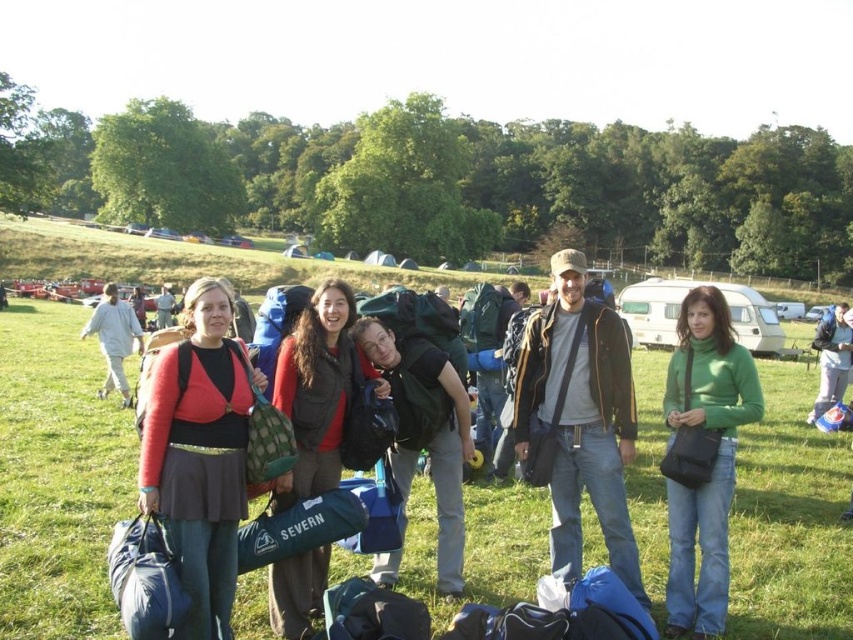
Question: Does matte red sweater at center appear under matte black backpack at center?

Choices:
 (A) yes
 (B) no

Answer: (A)

Question: Among these points, which one is nearest to the camera?

Choices:
 (A) (844, 358)
 (B) (572, 292)
 (C) (206, 516)

Answer: (C)

Question: Does green grass at center have a larger size compared to matte red jacket at center?

Choices:
 (A) yes
 (B) no

Answer: (A)

Question: Can you confirm if matte red jacket at center is thinner than blue backpack at center?

Choices:
 (A) yes
 (B) no

Answer: (A)

Question: Which point is closer to the camera taking this photo?

Choices:
 (A) (643, 604)
 (B) (303, 376)
 (C) (170, 307)

Answer: (A)

Question: Which point is closer to the camera?

Choices:
 (A) (67, 624)
 (B) (129, 401)
 (C) (171, 296)

Answer: (A)